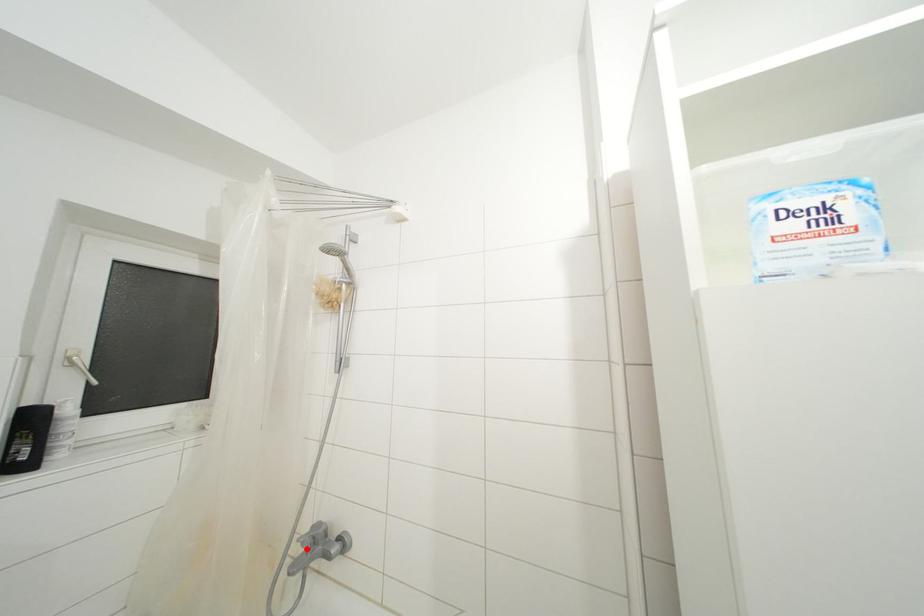
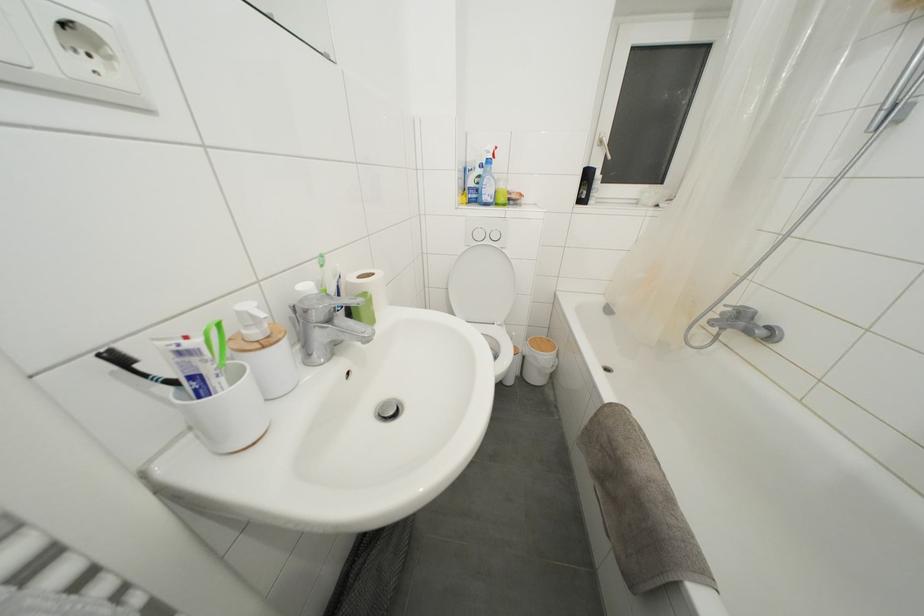
In the second image, find the point that corresponds to the highlighted location in the first image.

(726, 318)